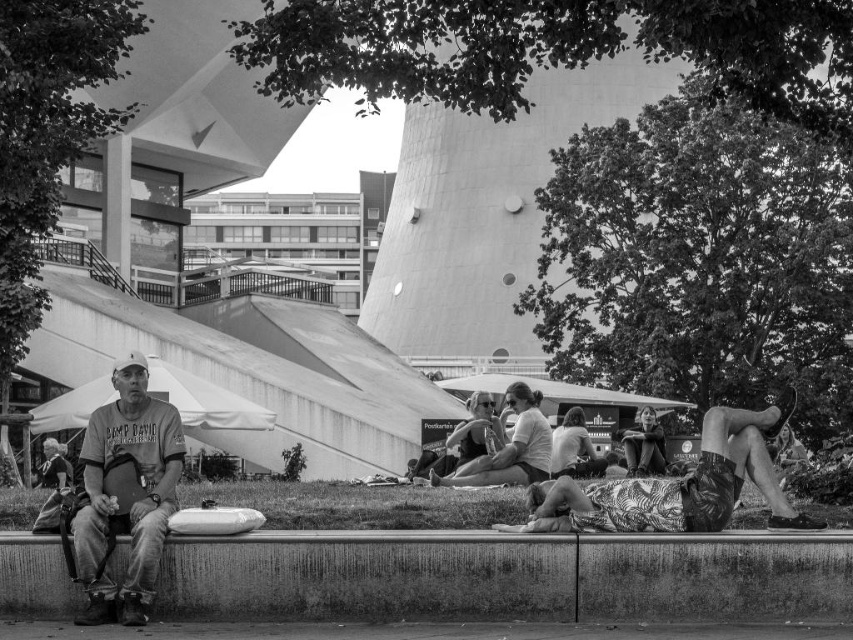
You are standing at the point labeled as point (508, 576). Looking around, you see a smooth concrete curb at lower center. Which direction should you walk to reach the nearest person sitting on the bench?

Walk towards the left side of the bench where the person in the Camp David t shirt is sitting because the point is located on the smooth concrete curb at lower center, which is near the bench area.

You are a delivery person trying to place a small package on the smooth concrete curb at lower center. The printed fabric shorts at center are currently on top of the curb. Can you place the package between the two objects without moving the shorts?

The smooth concrete curb at lower center might be wider than the printed fabric shorts at center, so there might be enough space to place the package between them without moving the shorts.

You are standing at the edge of the park and see the smooth concrete curb at lower center and the matte white shirt at center. Which object is closer to you?

The smooth concrete curb at lower center is closer to you because it is in front of the matte white shirt at center.